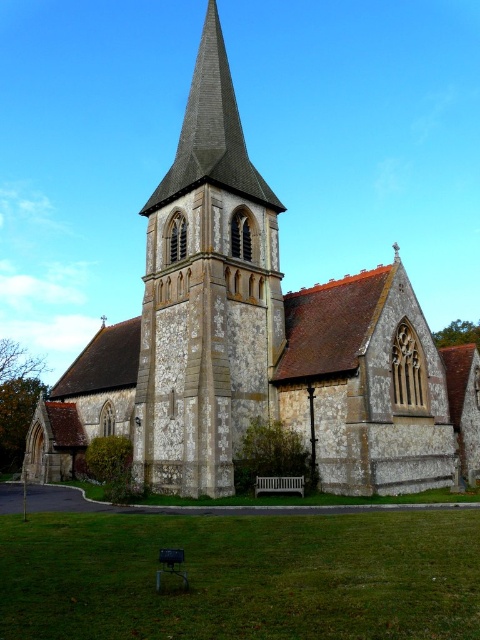
Question: Which of the following is the closest to the observer?

Choices:
 (A) click(254, 209)
 (B) click(420, 424)

Answer: (B)

Question: Which point is farther to the camera?

Choices:
 (A) stone church at center
 (B) stone spire at center

Answer: (B)

Question: Is stone church at center wider than stone spire at center?

Choices:
 (A) no
 (B) yes

Answer: (B)

Question: Which of the following is the farthest from the observer?

Choices:
 (A) stone spire at center
 (B) stone church at center

Answer: (A)

Question: From the image, what is the correct spatial relationship of stone church at center in relation to stone spire at center?

Choices:
 (A) left
 (B) right

Answer: (A)

Question: Is stone church at center below stone spire at center?

Choices:
 (A) yes
 (B) no

Answer: (A)